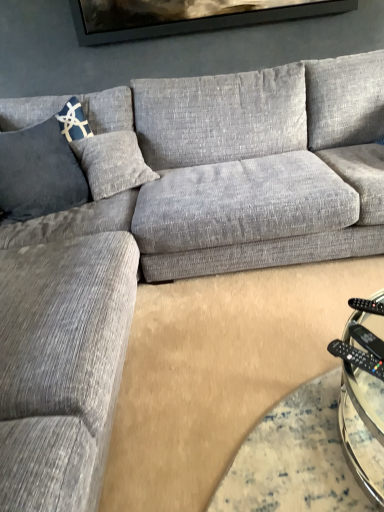
Question: From the image's perspective, does black plastic remote at lower right appear higher than black plastic remote at lower right, which ranks as the 2th remote in front-to-back order?

Choices:
 (A) yes
 (B) no

Answer: (B)

Question: Can you confirm if black plastic remote at lower right is bigger than black plastic remote at lower right, the second remote positioned from the bottom?

Choices:
 (A) no
 (B) yes

Answer: (B)

Question: Is black plastic remote at lower right, which ranks as the 2th remote in front-to-back order, at the back of black plastic remote at lower right?

Choices:
 (A) yes
 (B) no

Answer: (B)

Question: Is the depth of black plastic remote at lower right less than that of black plastic remote at lower right, the second remote positioned from the bottom?

Choices:
 (A) no
 (B) yes

Answer: (B)

Question: From the image's perspective, would you say black plastic remote at lower right is shown under black plastic remote at lower right, which ranks as the 2th remote in front-to-back order?

Choices:
 (A) yes
 (B) no

Answer: (A)

Question: Considering their positions, is blue textured pillow at left located in front of or behind black plastic remote at lower right, which ranks as the 2th remote in front-to-back order?

Choices:
 (A) behind
 (B) front

Answer: (A)

Question: From a real-world perspective, is blue textured pillow at left above or below black plastic remote at lower right, the second remote positioned from the bottom?

Choices:
 (A) above
 (B) below

Answer: (A)

Question: Looking at their shapes, would you say blue textured pillow at left is wider or thinner than black plastic remote at lower right, which ranks as the 2th remote in front-to-back order?

Choices:
 (A) thin
 (B) wide

Answer: (A)

Question: In the image, is blue textured pillow at left on the left side or the right side of black plastic remote at lower right, the second remote positioned from the bottom?

Choices:
 (A) right
 (B) left

Answer: (B)

Question: From a real-world perspective, is blue textured pillow at left above or below black plastic remote at lower right, which is counted as the 2th remote, starting from the back?

Choices:
 (A) below
 (B) above

Answer: (B)

Question: From the image's perspective, is blue textured pillow at left positioned above or below black plastic remote at lower right, which is the first remote from bottom to top?

Choices:
 (A) above
 (B) below

Answer: (A)

Question: Relative to black plastic remote at lower right, placed as the 2th remote when sorted from top to bottom, is blue textured pillow at left in front or behind?

Choices:
 (A) front
 (B) behind

Answer: (B)

Question: Considering the positions of blue textured pillow at left and black plastic remote at lower right, which is counted as the 2th remote, starting from the back, in the image, is blue textured pillow at left bigger or smaller than black plastic remote at lower right, which is counted as the 2th remote, starting from the back,?

Choices:
 (A) big
 (B) small

Answer: (A)

Question: Is black plastic remote at lower right, which ranks as the 2th remote in front-to-back order, in front of or behind black plastic remote at lower right, which is the first remote from bottom to top, in the image?

Choices:
 (A) front
 (B) behind

Answer: (B)

Question: Based on their sizes in the image, would you say black plastic remote at lower right, the second remote positioned from the bottom, is bigger or smaller than black plastic remote at lower right, placed as the 2th remote when sorted from top to bottom?

Choices:
 (A) big
 (B) small

Answer: (A)